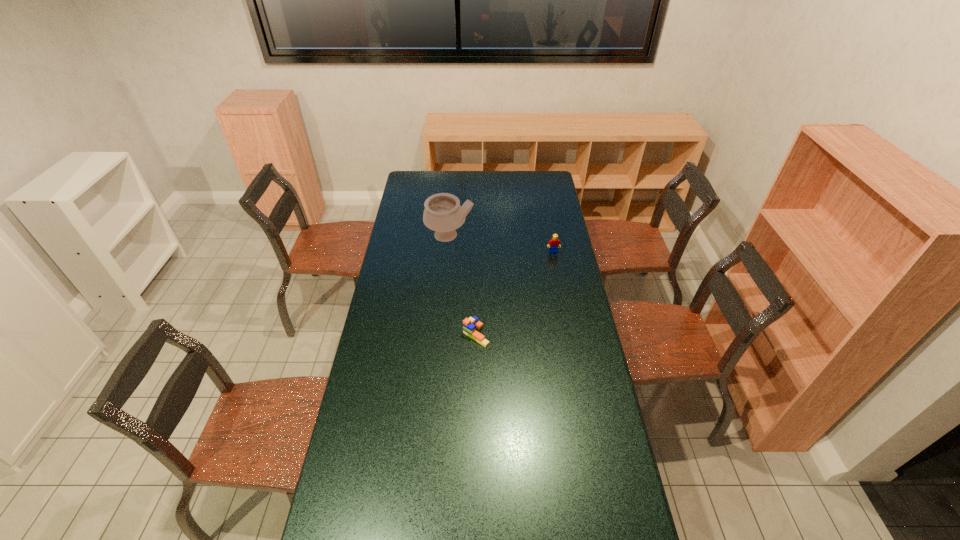
Where is `the tallest object`? Image resolution: width=960 pixels, height=540 pixels. the tallest object is located at coordinates (443, 213).

Find the location of a particular element. pottery is located at coordinates (443, 213).

You are a GUI agent. You are given a task and a screenshot of the screen. Output one action in this format:
    pyautogui.click(x=<x>, y=<y>)
    Task: Click on the taller Lego
    
    Given the screenshot: What is the action you would take?
    pyautogui.click(x=553, y=245)

Locate an element on the screen. the second farthest object is located at coordinates (553, 245).

You are a GUI agent. You are given a task and a screenshot of the screen. Output one action in this format:
    pyautogui.click(x=<x>, y=<y>)
    Task: Click on the left Lego
    
    Given the screenshot: What is the action you would take?
    pyautogui.click(x=470, y=325)

I want to click on the shortest object, so click(470, 325).

The image size is (960, 540). What are the coordinates of `blank area located on the right of the pottery` in the screenshot? It's located at (549, 236).

Find the location of a particular element. The height and width of the screenshot is (540, 960). vacant space located 0.060m on the front-facing side of the second tallest object is located at coordinates (555, 261).

Where is `vacant region located on the right of the left Lego`? vacant region located on the right of the left Lego is located at coordinates (567, 335).

You are a GUI agent. You are given a task and a screenshot of the screen. Output one action in this format:
    pyautogui.click(x=<x>, y=<y>)
    Task: Click on the object at the right edge
    The image size is (960, 540).
    Given the screenshot: What is the action you would take?
    pyautogui.click(x=553, y=245)